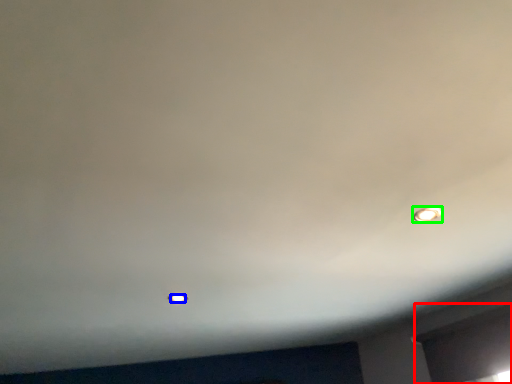
Question: Based on their relative distances, which object is nearer to window (highlighted by a red box)? Choose from light bulb (highlighted by a blue box) and light bulb (highlighted by a green box).

Choices:
 (A) light bulb
 (B) light bulb

Answer: (B)